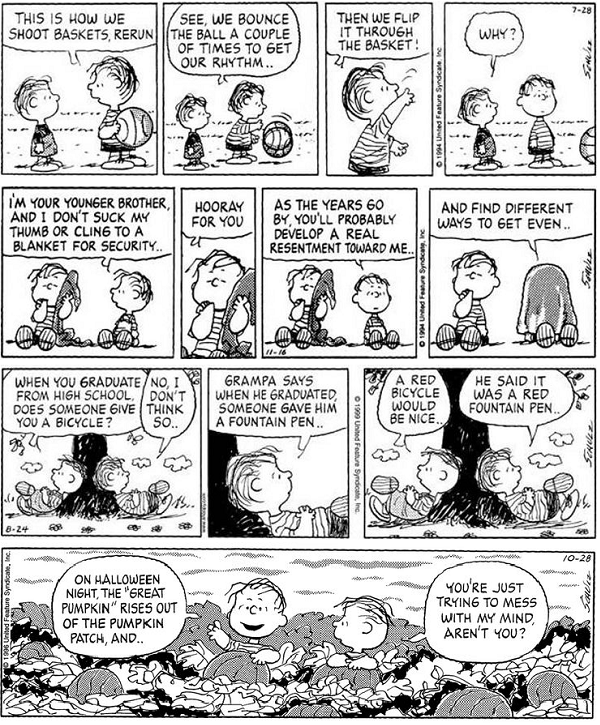
I want to click on security blanket, so click(x=66, y=286), click(x=248, y=283), click(x=324, y=281), click(x=549, y=296).